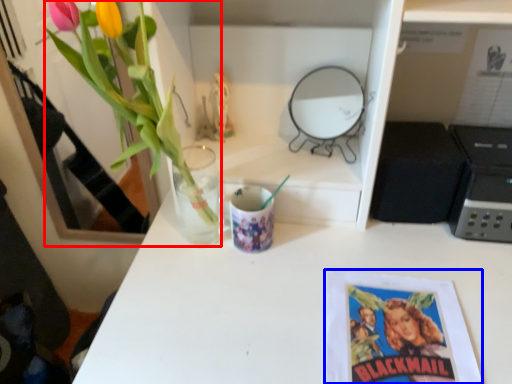
Question: Which point is closer to the camera, floral arrangement (highlighted by a red box) or book cover (highlighted by a blue box)?

Choices:
 (A) floral arrangement
 (B) book cover

Answer: (A)